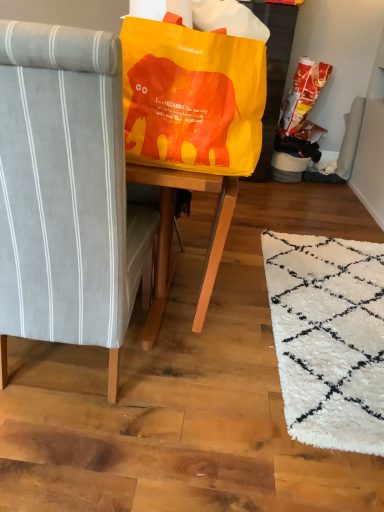
Question: Is matte orange plastic bag at upper right turned away from gray fabric chair at left?

Choices:
 (A) no
 (B) yes

Answer: (A)

Question: Is matte orange plastic bag at upper right oriented towards gray fabric chair at left?

Choices:
 (A) no
 (B) yes

Answer: (A)

Question: Can you confirm if matte orange plastic bag at upper right is thinner than gray fabric chair at left?

Choices:
 (A) yes
 (B) no

Answer: (A)

Question: Is matte orange plastic bag at upper right beside gray fabric chair at left?

Choices:
 (A) yes
 (B) no

Answer: (B)

Question: From the image's perspective, is matte orange plastic bag at upper right on gray fabric chair at left?

Choices:
 (A) no
 (B) yes

Answer: (B)

Question: Would you say matte orange plastic bag at upper right is a long distance from gray fabric chair at left?

Choices:
 (A) yes
 (B) no

Answer: (A)

Question: From a real-world perspective, is gray fabric chair at left positioned under matte orange plastic bag at upper right based on gravity?

Choices:
 (A) no
 (B) yes

Answer: (B)

Question: Is gray fabric chair at left wider than matte orange plastic bag at upper right?

Choices:
 (A) no
 (B) yes

Answer: (B)

Question: From the image's perspective, is gray fabric chair at left below matte orange plastic bag at upper right?

Choices:
 (A) no
 (B) yes

Answer: (B)

Question: Is gray fabric chair at left positioned before matte orange plastic bag at upper right?

Choices:
 (A) yes
 (B) no

Answer: (A)

Question: Could you tell me if gray fabric chair at left is turned towards matte orange plastic bag at upper right?

Choices:
 (A) no
 (B) yes

Answer: (A)

Question: Is gray fabric chair at left turned away from matte orange plastic bag at upper right?

Choices:
 (A) no
 (B) yes

Answer: (A)

Question: Does matte orange plastic bag at upper right have a lesser width compared to matte yellow bean bag chair at upper center?

Choices:
 (A) no
 (B) yes

Answer: (B)